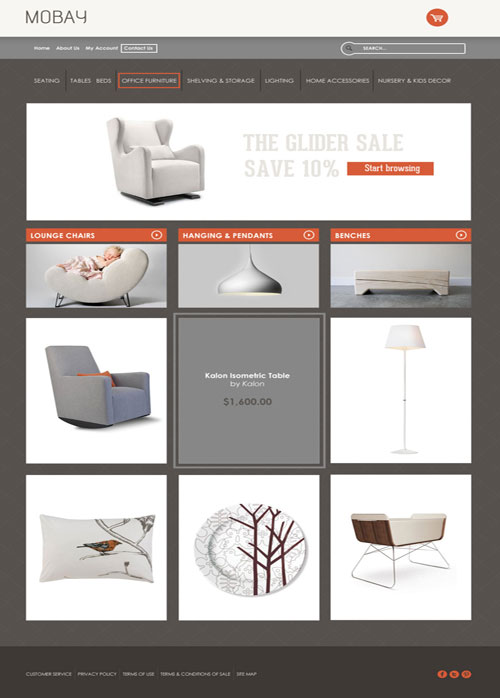
At what (x,y) coordinates should I click in order to perform the action: click on small chair with a baby. Please return your answer as a coordinate pair (x, y). Looking at the image, I should click on (96, 292).